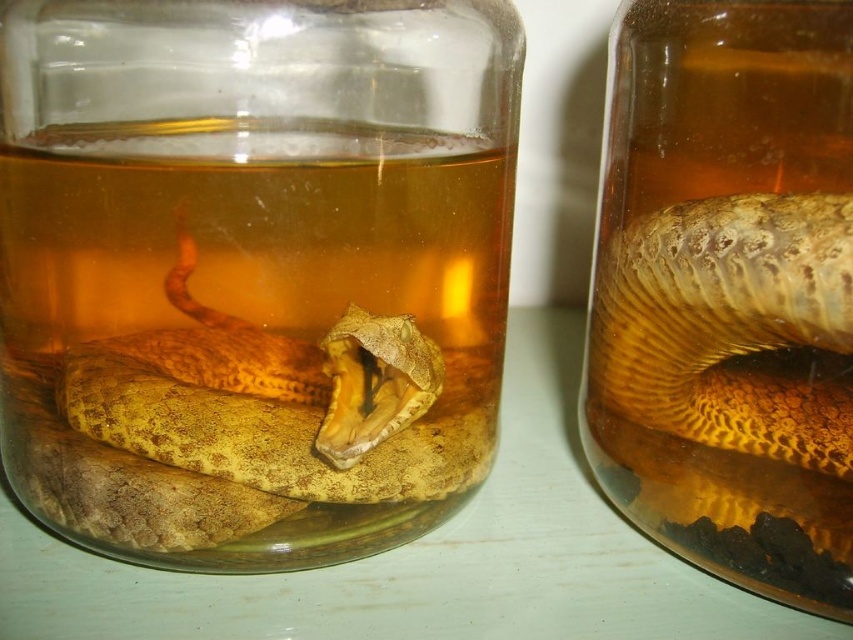
You are a researcher examining the image of two jars with snakes. You need to locate the translucent glass jar at center. What are its coordinates?

The translucent glass jar at center is located at coordinates point (251,268).

You are a researcher examining the jars. You notice the translucent amber liquid at right and the yellow scaly snake at right. Which one is positioned more to the left in the image?

The translucent amber liquid at right is positioned more to the left than the yellow scaly snake at right.